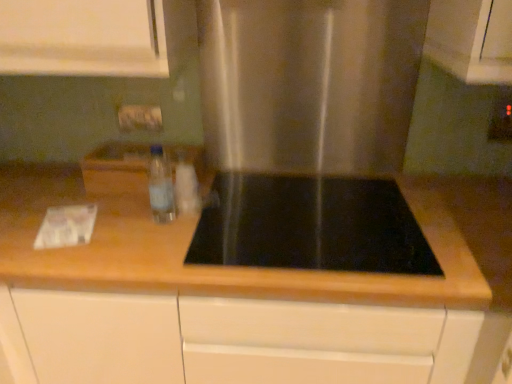
The height and width of the screenshot is (384, 512). Find the location of `translucent plastic bottle at center, acting as the second bottle starting from the left`. translucent plastic bottle at center, acting as the second bottle starting from the left is located at coordinates (186, 186).

Find the location of a particular element. The width and height of the screenshot is (512, 384). clear plastic bottle at center, placed as the first bottle when sorted from left to right is located at coordinates (161, 186).

This screenshot has width=512, height=384. What do you see at coordinates (161, 186) in the screenshot?
I see `clear plastic bottle at center, placed as the first bottle when sorted from left to right` at bounding box center [161, 186].

Where is `black glass gas stove at center`? Image resolution: width=512 pixels, height=384 pixels. black glass gas stove at center is located at coordinates (310, 225).

In terms of size, does black glass gas stove at center appear bigger or smaller than clear plastic bottle at center, placed as the first bottle when sorted from left to right?

Clearly, black glass gas stove at center is larger in size than clear plastic bottle at center, placed as the first bottle when sorted from left to right.

From a real-world perspective, between black glass gas stove at center and clear plastic bottle at center, the second bottle viewed from the right, who is vertically lower?

black glass gas stove at center, from a real-world perspective.

Based on their positions, is black glass gas stove at center located to the left or right of clear plastic bottle at center, the second bottle viewed from the right?

Based on their positions, black glass gas stove at center is located to the right of clear plastic bottle at center, the second bottle viewed from the right.

Is black glass gas stove at center oriented towards clear plastic bottle at center, the second bottle viewed from the right?

No, black glass gas stove at center is not facing towards clear plastic bottle at center, the second bottle viewed from the right.

How much distance is there between translucent plastic bottle at center, the 1th bottle in the right-to-left sequence, and matte plastic electric outlet at upper right?

translucent plastic bottle at center, the 1th bottle in the right-to-left sequence, is 1.01 meters away from matte plastic electric outlet at upper right.

Where is `electric outlet above the translucent plastic bottle at center, the 1th bottle in the right-to-left sequence (from a real-world perspective)`? electric outlet above the translucent plastic bottle at center, the 1th bottle in the right-to-left sequence (from a real-world perspective) is located at coordinates 501,120.

From a real-world perspective, is translucent plastic bottle at center, the 1th bottle in the right-to-left sequence, below matte plastic electric outlet at upper right?

Yes, from a real-world perspective, translucent plastic bottle at center, the 1th bottle in the right-to-left sequence, is under matte plastic electric outlet at upper right.

Considering the sizes of objects translucent plastic bottle at center, the 1th bottle in the right-to-left sequence, and matte plastic electric outlet at upper right in the image provided, who is taller, translucent plastic bottle at center, the 1th bottle in the right-to-left sequence, or matte plastic electric outlet at upper right?

matte plastic electric outlet at upper right.

Where is `countertop in front of the matte plastic electric outlet at upper right`? countertop in front of the matte plastic electric outlet at upper right is located at coordinates (241, 300).

Does matte plastic electric outlet at upper right have a greater width compared to wooden at center?

No, matte plastic electric outlet at upper right is not wider than wooden at center.

Which is in front, matte plastic electric outlet at upper right or wooden at center?

wooden at center is in front.

From the image's perspective, is matte plastic electric outlet at upper right on wooden at center?

Yes, from the image's perspective, matte plastic electric outlet at upper right is over wooden at center.

Considering the positions of point (392, 254) and point (455, 235), is point (392, 254) closer or farther from the camera than point (455, 235)?

Point (392, 254).

Identify the location of countertop in front of the black glass gas stove at center. The height and width of the screenshot is (384, 512). (241, 300).

Between black glass gas stove at center and wooden at center, which one has larger size?

With larger size is wooden at center.

Considering the sizes of objects black glass gas stove at center and wooden at center in the image provided, who is shorter, black glass gas stove at center or wooden at center?

black glass gas stove at center is shorter.

From the image's perspective, does clear plastic bottle at center, placed as the first bottle when sorted from left to right, appear lower than translucent plastic bottle at center, acting as the second bottle starting from the left?

No, from the image's perspective, clear plastic bottle at center, placed as the first bottle when sorted from left to right, is not beneath translucent plastic bottle at center, acting as the second bottle starting from the left.

Is the depth of clear plastic bottle at center, placed as the first bottle when sorted from left to right, less than that of translucent plastic bottle at center, acting as the second bottle starting from the left?

Yes, clear plastic bottle at center, placed as the first bottle when sorted from left to right, is in front of translucent plastic bottle at center, acting as the second bottle starting from the left.

Is clear plastic bottle at center, placed as the first bottle when sorted from left to right, situated inside translucent plastic bottle at center, acting as the second bottle starting from the left, or outside?

clear plastic bottle at center, placed as the first bottle when sorted from left to right, cannot be found inside translucent plastic bottle at center, acting as the second bottle starting from the left.

Who is bigger, clear plastic bottle at center, the second bottle viewed from the right, or translucent plastic bottle at center, the 1th bottle in the right-to-left sequence?

translucent plastic bottle at center, the 1th bottle in the right-to-left sequence.

From a real-world perspective, is black glass gas stove at center positioned under translucent plastic bottle at center, the 1th bottle in the right-to-left sequence, based on gravity?

Yes, from a real-world perspective, black glass gas stove at center is below translucent plastic bottle at center, the 1th bottle in the right-to-left sequence.

Is black glass gas stove at center wider than translucent plastic bottle at center, acting as the second bottle starting from the left?

Indeed, black glass gas stove at center has a greater width compared to translucent plastic bottle at center, acting as the second bottle starting from the left.

Consider the image. Which point is more forward, (378, 249) or (192, 165)?

The point (378, 249) is more forward.

Is black glass gas stove at center to the right of translucent plastic bottle at center, the 1th bottle in the right-to-left sequence, from the viewer's perspective?

Yes, black glass gas stove at center is to the right of translucent plastic bottle at center, the 1th bottle in the right-to-left sequence.

Considering the sizes of objects clear plastic bottle at center, the second bottle viewed from the right, and matte plastic electric outlet at upper right in the image provided, who is shorter, clear plastic bottle at center, the second bottle viewed from the right, or matte plastic electric outlet at upper right?

matte plastic electric outlet at upper right is shorter.

Does clear plastic bottle at center, placed as the first bottle when sorted from left to right, come in front of matte plastic electric outlet at upper right?

Yes, the depth of clear plastic bottle at center, placed as the first bottle when sorted from left to right, is less than that of matte plastic electric outlet at upper right.

Between clear plastic bottle at center, the second bottle viewed from the right, and matte plastic electric outlet at upper right, which one appears on the left side from the viewer's perspective?

From the viewer's perspective, clear plastic bottle at center, the second bottle viewed from the right, appears more on the left side.

Does clear plastic bottle at center, the second bottle viewed from the right, have a greater width compared to matte plastic electric outlet at upper right?

Yes.

This screenshot has width=512, height=384. I want to click on the 2nd bottle positioned above the black glass gas stove at center (from the image's perspective), so click(161, 186).

Locate an element on the screen. bottle that is the 2nd one when counting downward from the matte plastic electric outlet at upper right (from the image's perspective) is located at coordinates (186, 186).

Looking at the image, which one is located closer to clear plastic bottle at center, placed as the first bottle when sorted from left to right, wooden at center or matte plastic electric outlet at upper right?

wooden at center is closer to clear plastic bottle at center, placed as the first bottle when sorted from left to right.

Based on the photo, considering their positions, is black glass gas stove at center positioned further to translucent plastic bottle at center, the 1th bottle in the right-to-left sequence, than matte plastic electric outlet at upper right?

Among the two, matte plastic electric outlet at upper right is located further to translucent plastic bottle at center, the 1th bottle in the right-to-left sequence.

Which object lies further to the anchor point translucent plastic bottle at center, the 1th bottle in the right-to-left sequence, matte plastic electric outlet at upper right or wooden at center?

matte plastic electric outlet at upper right.

In the scene shown: Considering their positions, is translucent plastic bottle at center, acting as the second bottle starting from the left, positioned closer to wooden at center than matte plastic electric outlet at upper right?

The object closer to wooden at center is translucent plastic bottle at center, acting as the second bottle starting from the left.

Looking at the image, which one is located closer to translucent plastic bottle at center, acting as the second bottle starting from the left, wooden at center or matte plastic electric outlet at upper right?

wooden at center is positioned closer to the anchor translucent plastic bottle at center, acting as the second bottle starting from the left.

Based on their spatial positions, is translucent plastic bottle at center, acting as the second bottle starting from the left, or wooden at center closer to black glass gas stove at center?

wooden at center is closer to black glass gas stove at center.

Based on the photo, when comparing their distances from black glass gas stove at center, does clear plastic bottle at center, the second bottle viewed from the right, or translucent plastic bottle at center, the 1th bottle in the right-to-left sequence, seem closer?

Based on the image, translucent plastic bottle at center, the 1th bottle in the right-to-left sequence, appears to be nearer to black glass gas stove at center.

Which object lies nearer to the anchor point matte plastic electric outlet at upper right, black glass gas stove at center or wooden at center?

The object closer to matte plastic electric outlet at upper right is black glass gas stove at center.

Where is `gas stove between clear plastic bottle at center, placed as the first bottle when sorted from left to right, and wooden at center in the up-down direction`? This screenshot has width=512, height=384. gas stove between clear plastic bottle at center, placed as the first bottle when sorted from left to right, and wooden at center in the up-down direction is located at coordinates (310, 225).

Where is `bottle between clear plastic bottle at center, the second bottle viewed from the right, and matte plastic electric outlet at upper right`? bottle between clear plastic bottle at center, the second bottle viewed from the right, and matte plastic electric outlet at upper right is located at coordinates (186, 186).

Locate an element on the screen. This screenshot has height=384, width=512. countertop located between clear plastic bottle at center, the second bottle viewed from the right, and matte plastic electric outlet at upper right in the left-right direction is located at coordinates (241, 300).

Find the location of a particular element. bottle between clear plastic bottle at center, placed as the first bottle when sorted from left to right, and black glass gas stove at center from left to right is located at coordinates (186, 186).